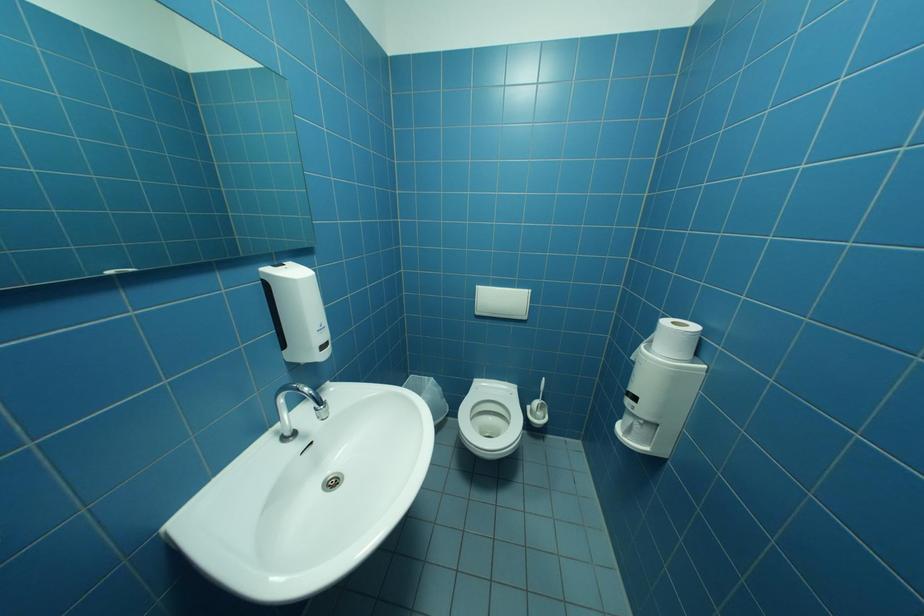
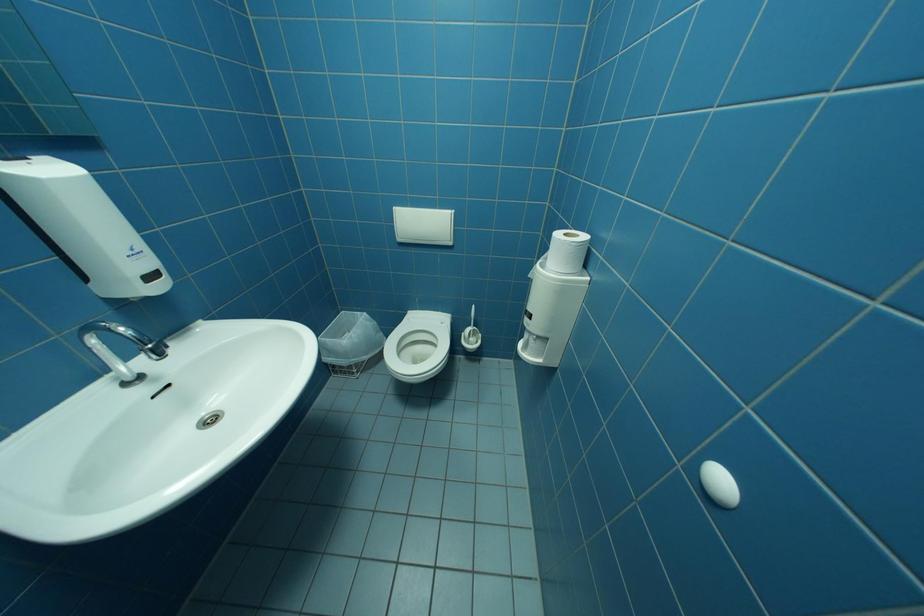
Question: The first image is from the beginning of the video and the second image is from the end. How did the camera likely rotate when shooting the video?

Choices:
 (A) Left
 (B) Right
 (C) Up
 (D) Down

Answer: (D)